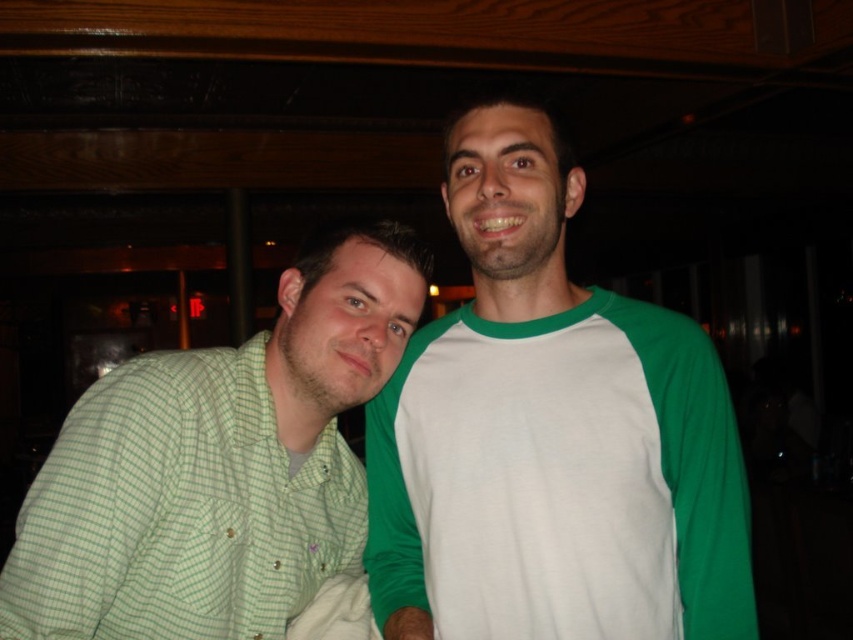
Question: Which of the following is the closest to the observer?

Choices:
 (A) (556, 280)
 (B) (262, 378)

Answer: (A)

Question: Which of the following is the closest to the observer?

Choices:
 (A) (73, 480)
 (B) (483, 362)

Answer: (A)

Question: In this image, where is white/green raglan shirt at center located relative to green checkered shirt at left?

Choices:
 (A) below
 (B) above

Answer: (B)

Question: Is white/green raglan shirt at center above green checkered shirt at left?

Choices:
 (A) yes
 (B) no

Answer: (A)

Question: Does white/green raglan shirt at center appear under green checkered shirt at left?

Choices:
 (A) yes
 (B) no

Answer: (B)